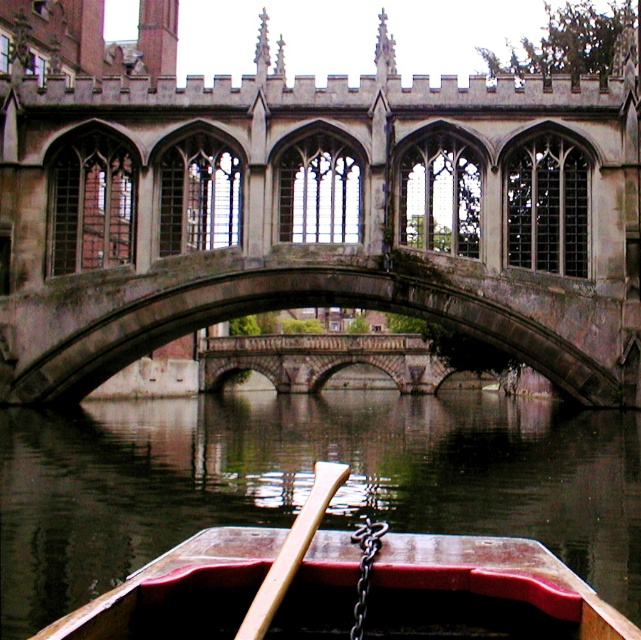
You are standing at the point marked by the coordinates point (483,592). What object are you directly facing?

The point (483,592) indicates wooden canoe at center, so you are directly facing the wooden canoe at center.